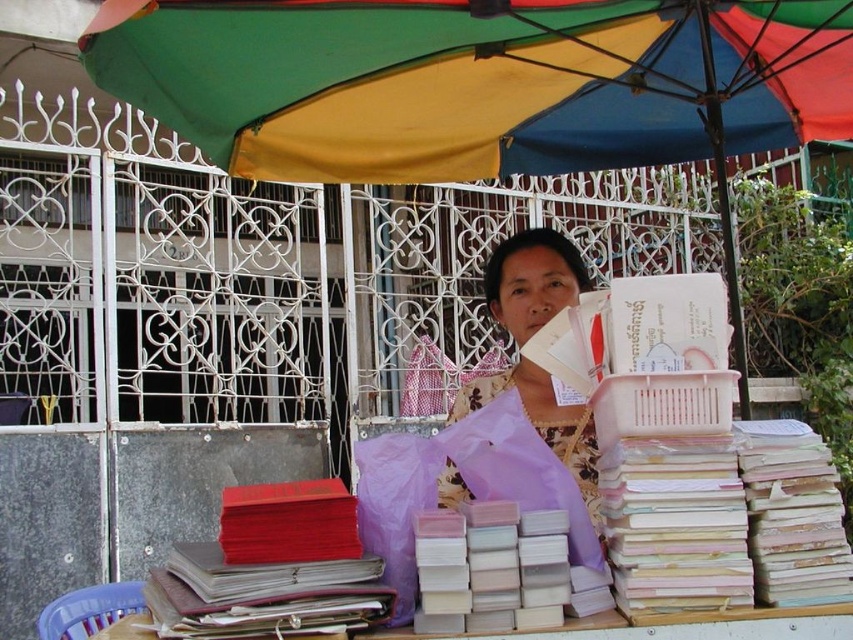
You are a customer who wants to buy a book from the vendor. You are standing 1.5 meters away from the wooden table at lower center. Can you reach the multicolored fabric umbrella at upper center without moving closer to the table?

The distance between the multicolored fabric umbrella at upper center and the wooden table at lower center is 2.17 meters. Since you are already 1.5 meters away from the wooden table at lower center, you would need to move an additional 0.67 meters forward to reach the umbrella. Therefore, you cannot reach the umbrella without moving closer to the table.

You are a customer looking to buy a book from the vendor. You see the red leather book at left and the white matte book at center. Which book is closer to you?

The red leather book at left is closer to you because it is positioned under the white matte book at center, indicating it is in front.

You are a customer browsing the vendor stall. You want to place the red leather book at left and the white matte book at center on a shelf at home. Which book will occupy more vertical space on the shelf?

The red leather book at left is much taller than the white matte book at center, so it will occupy more vertical space on the shelf.